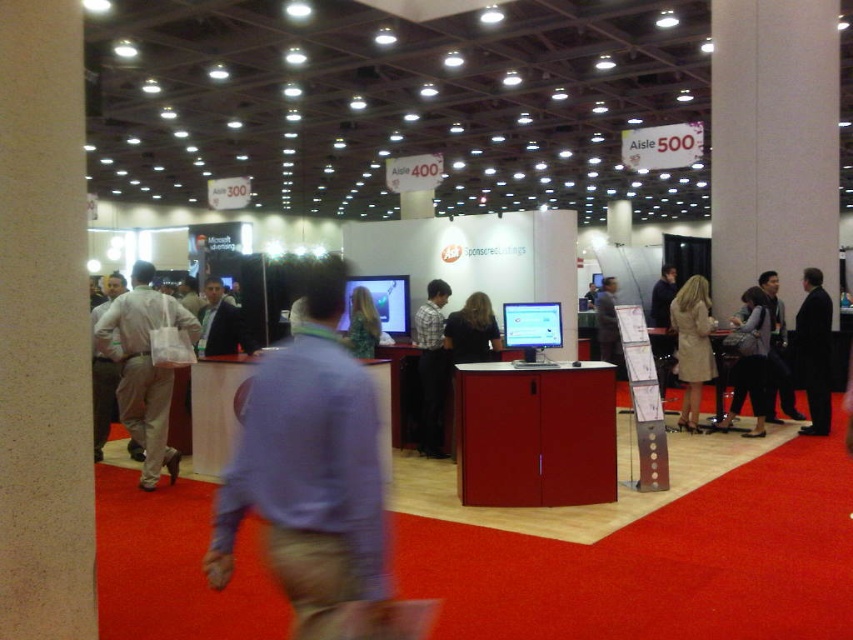
You are organizing a trade show booth and need to place a white fabric bag at left and a matte gray coat at center on a shelf. Which object should you place first if you want to ensure both fit without overlapping?

The white fabric bag at left has a larger width than the matte gray coat at center, so you should place the white fabric bag at left first to ensure both items fit without overlapping.

You are a fashion designer attending the exhibition and notice two garments in the scene. Which one is larger in size between the light beige coat at right and the floral dress at center?

The light beige coat at right is bigger than the floral dress at center.

You are standing at the center of the exhibition hall and want to locate the light beige coat at right. According to the coordinates provided, in which direction should you move to find it?

The light beige coat at right is located at coordinates point (692, 346). Since you are at the center, moving towards the right side of the exhibition hall would lead you to the light beige coat at right.